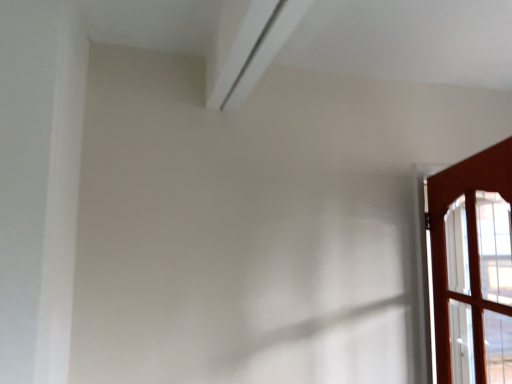
Describe the element at coordinates (468, 229) in the screenshot. I see `wooden-framed glass window at right` at that location.

What is the approximate width of wooden-framed glass window at right?

wooden-framed glass window at right is 9.42 inches wide.

This screenshot has width=512, height=384. I want to click on wooden-framed glass window at right, so click(468, 229).

The width and height of the screenshot is (512, 384). I want to click on wooden-framed glass window at right, so click(x=468, y=229).